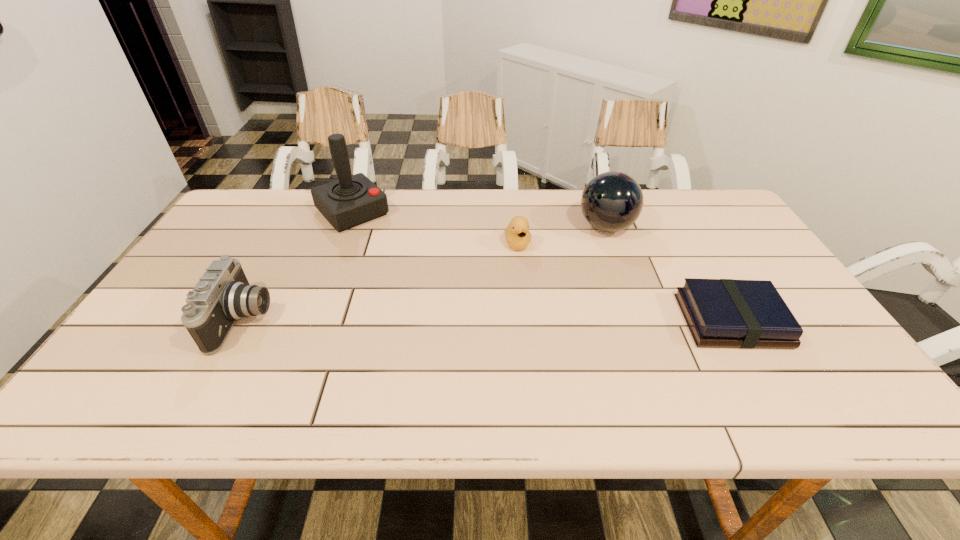
Where is `camera`? Image resolution: width=960 pixels, height=540 pixels. camera is located at coordinates (223, 295).

At what (x,y) coordinates should I click in order to perform the action: click on book. Please return your answer as a coordinate pair (x, y). The height and width of the screenshot is (540, 960). Looking at the image, I should click on (728, 313).

Locate an element on the screen. The width and height of the screenshot is (960, 540). the rightmost object is located at coordinates (728, 313).

Locate an element on the screen. This screenshot has width=960, height=540. duckling is located at coordinates (517, 234).

Where is `the third object from right to left`? The image size is (960, 540). the third object from right to left is located at coordinates (517, 234).

Identify the location of the second tallest object. (612, 201).

Image resolution: width=960 pixels, height=540 pixels. Identify the location of bowling ball. (612, 201).

You are a GUI agent. You are given a task and a screenshot of the screen. Output one action in this format:
    pyautogui.click(x=<x>, y=<y>)
    Task: Click on the tallest object
    The height and width of the screenshot is (540, 960).
    Given the screenshot: What is the action you would take?
    click(352, 200)

Locate an element on the screen. The image size is (960, 540). free region located 0.190m on the front-facing side of the third shortest object is located at coordinates (348, 320).

I want to click on vacant space situated 0.130m on the left of the book, so (x=631, y=321).